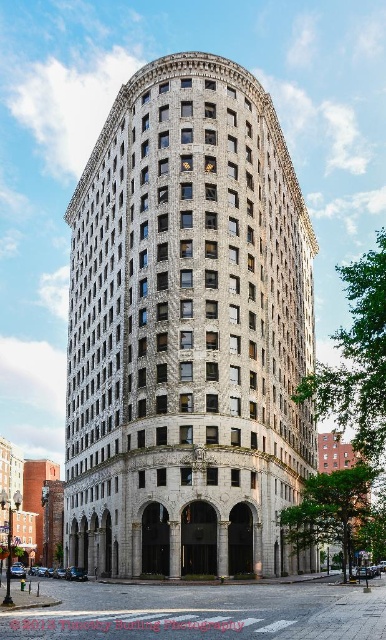
Question: Is white stone building at center to the left of brick building at lower right from the viewer's perspective?

Choices:
 (A) no
 (B) yes

Answer: (B)

Question: Can you confirm if white stone building at center is wider than brick building at lower right?

Choices:
 (A) yes
 (B) no

Answer: (A)

Question: Considering the relative positions of white stone building at center and brick building at lower right in the image provided, where is white stone building at center located with respect to brick building at lower right?

Choices:
 (A) above
 (B) below

Answer: (A)

Question: Which object appears farthest from the camera in this image?

Choices:
 (A) brick building at lower right
 (B) white stone building at center

Answer: (B)

Question: Which point is farther from the camera taking this photo?

Choices:
 (A) (340, 452)
 (B) (187, 273)

Answer: (A)